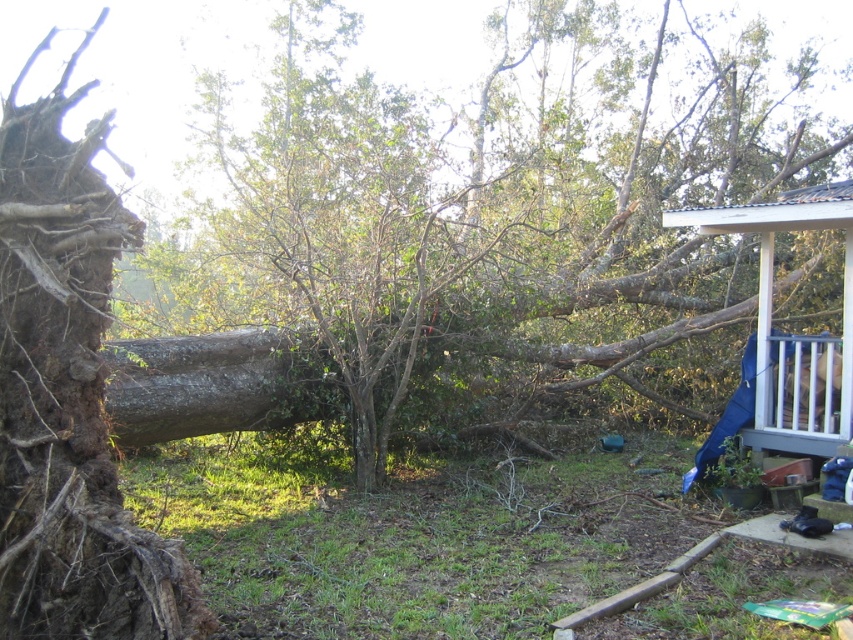
Question: Which point appears farthest from the camera in this image?

Choices:
 (A) (671, 280)
 (B) (762, 326)

Answer: (A)

Question: From the image, what is the correct spatial relationship of green rough bark tree at center in relation to brown rough bark at left?

Choices:
 (A) below
 (B) above

Answer: (B)

Question: Which of the following is the closest to the observer?

Choices:
 (A) brown rough bark at left
 (B) green rough bark tree at center
 (C) white wooden porch at upper right

Answer: (A)

Question: Does brown rough bark at left appear under white wooden porch at upper right?

Choices:
 (A) no
 (B) yes

Answer: (B)

Question: Which of these objects is positioned closest to the white wooden porch at upper right?

Choices:
 (A) green rough bark tree at center
 (B) brown rough bark at left

Answer: (A)

Question: Does green rough bark tree at center appear over brown rough bark at left?

Choices:
 (A) no
 (B) yes

Answer: (B)